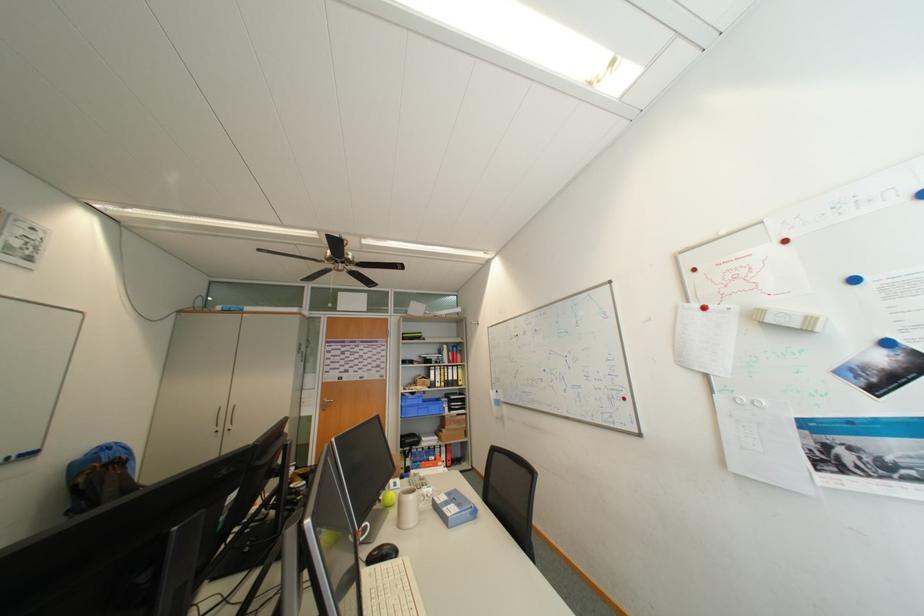
Where would you slid the black computer mouse? Please return your answer as a coordinate pair (x, y).

(382, 554)